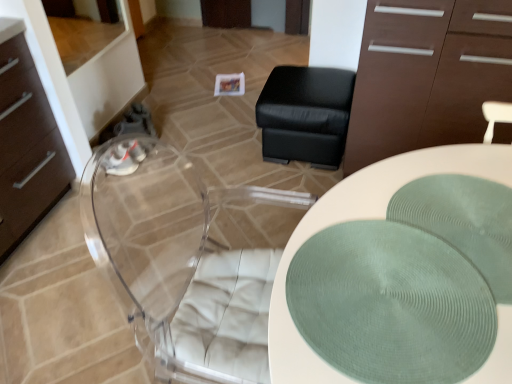
The image size is (512, 384). I want to click on free space that is to the left of black leather ottoman at center, so click(225, 150).